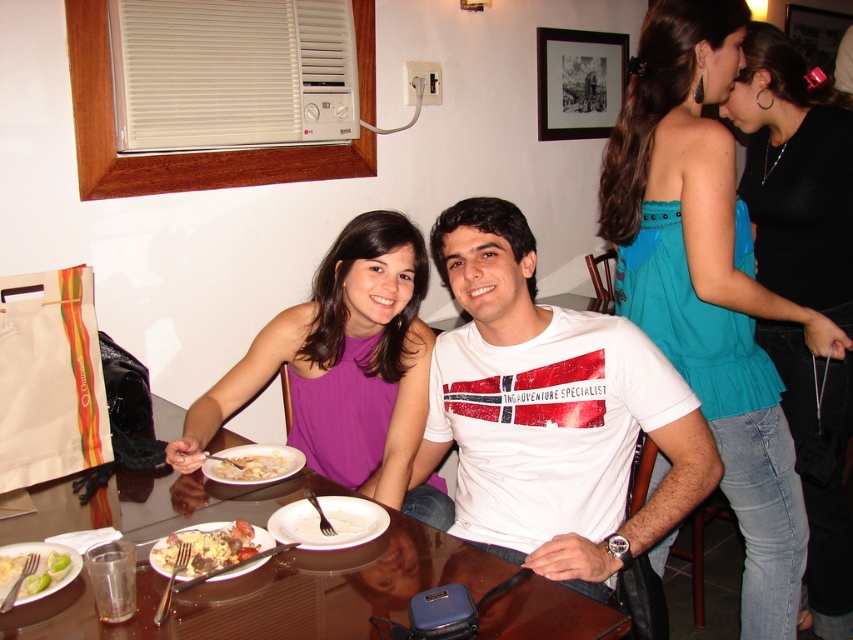
What is located at the point with coordinates (549, 412)?

The point with coordinates (549, 412) corresponds to the white cotton t shirt at center.

You are a photographer trying to capture a candid shot of both the teal satin blouse at upper right and the purple ribbed tank top at center. Your camera has a maximum focus range of 24 inches. Can you fit both subjects within the camera frame without moving the camera?

The distance between the teal satin blouse at upper right and the purple ribbed tank top at center is 24.43 inches. Since the camera can only focus up to 24 inches, the subjects are slightly out of range. You might need to adjust your position or use a different lens to capture both clearly.